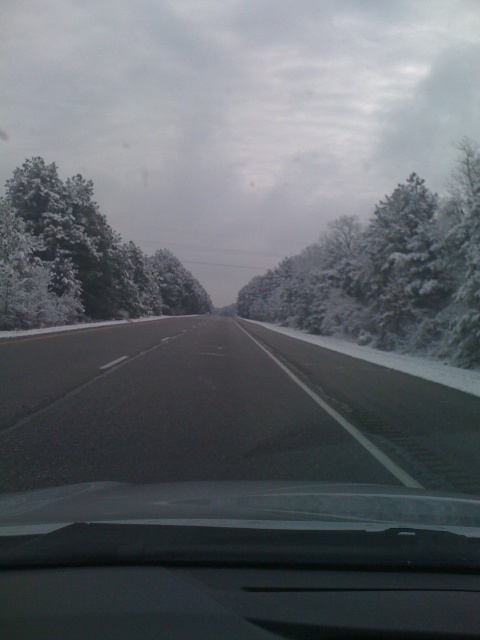
Question: Observing the image, what is the correct spatial positioning of black asphalt highway at center in reference to snow-covered evergreen at center?

Choices:
 (A) right
 (B) left

Answer: (B)

Question: Can you confirm if black asphalt highway at center is positioned above snow-covered evergreen at center?

Choices:
 (A) no
 (B) yes

Answer: (A)

Question: Can you confirm if snow-covered evergreen at center is wider than white frosty trees at left?

Choices:
 (A) no
 (B) yes

Answer: (B)

Question: Among these points, which one is farthest from the camera?

Choices:
 (A) (15, 179)
 (B) (153, 468)

Answer: (A)

Question: Which point appears closest to the camera in this image?

Choices:
 (A) (108, 248)
 (B) (130, 374)

Answer: (B)

Question: Which point is closer to the camera?

Choices:
 (A) (54, 205)
 (B) (464, 467)

Answer: (B)